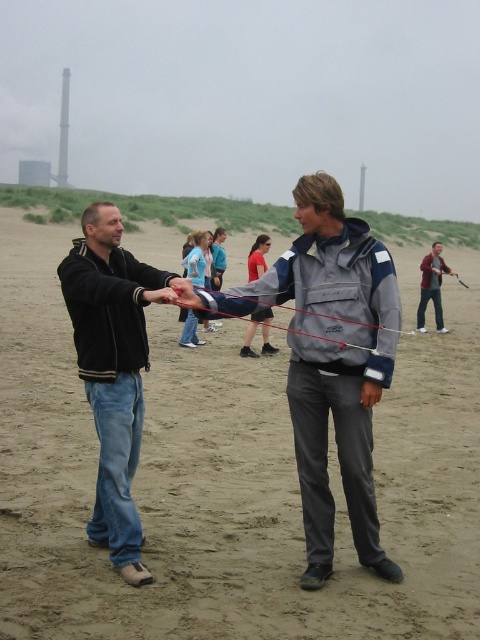
Question: Observing the image, what is the correct spatial positioning of matte black jacket at center in reference to red string at center?

Choices:
 (A) left
 (B) right

Answer: (B)

Question: Is red string at center positioned at the back of maroon fabric jacket at center?

Choices:
 (A) no
 (B) yes

Answer: (A)

Question: Which object is the farthest from the matte black jacket at center?

Choices:
 (A) black matte jacket at left
 (B) maroon fabric jacket at center
 (C) red string at center

Answer: (A)

Question: Is maroon fabric jacket at center below red fabric shorts at center?

Choices:
 (A) no
 (B) yes

Answer: (A)

Question: Which object is positioned farthest from the maroon fabric jacket at center?

Choices:
 (A) gray fabric jacket at center
 (B) matte black jacket at center
 (C) black matte jacket at left

Answer: (C)

Question: Estimate the real-world distances between objects in this image. Which object is farther from the red fabric shorts at center?

Choices:
 (A) black matte jacket at left
 (B) maroon fabric jacket at center
 (C) gray fabric jacket at center

Answer: (B)